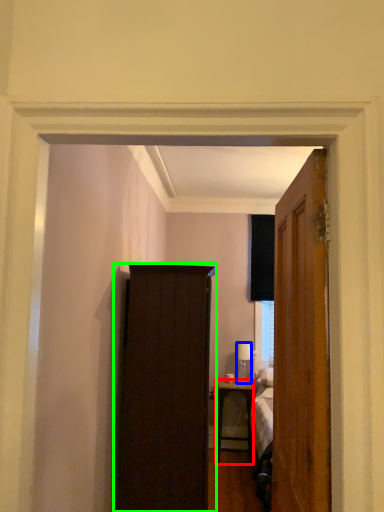
Question: Which object is the closest to the desk (highlighted by a red box)? Choose among these: lamp (highlighted by a blue box) or cabinetry (highlighted by a green box).

Choices:
 (A) lamp
 (B) cabinetry

Answer: (A)